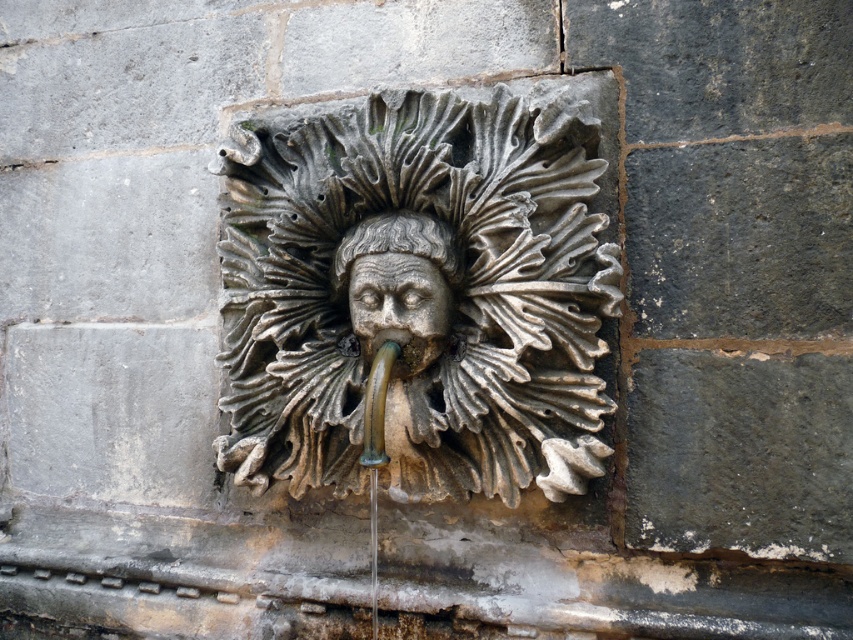
From the picture: You are an architect examining the fountain and need to determine the spatial relationship between the gray stone mask at center and the gray stone face at center. Which object has a greater width?

The gray stone mask at center has a greater width than the gray stone face at center according to the description.

You are an art conservator examining the fountain. You notice two features labeled as the gray stone mask at center and the gray stone face at center. Which object is positioned closer to you?

The gray stone mask at center is in front of the gray stone face at center, so it is closer to you.